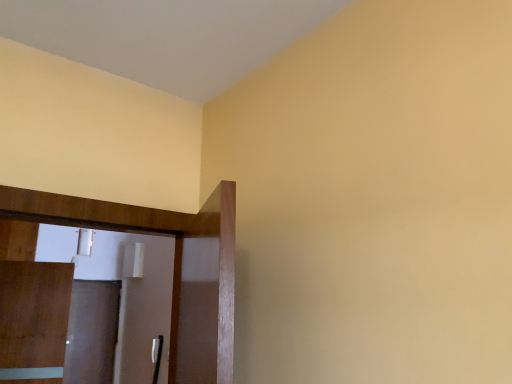
This screenshot has height=384, width=512. What do you see at coordinates (92, 332) in the screenshot?
I see `transparent glass screen door at lower left` at bounding box center [92, 332].

The height and width of the screenshot is (384, 512). What are the coordinates of `transparent glass screen door at lower left` in the screenshot? It's located at (92, 332).

The width and height of the screenshot is (512, 384). What are the coordinates of `transparent glass screen door at lower left` in the screenshot? It's located at (92, 332).